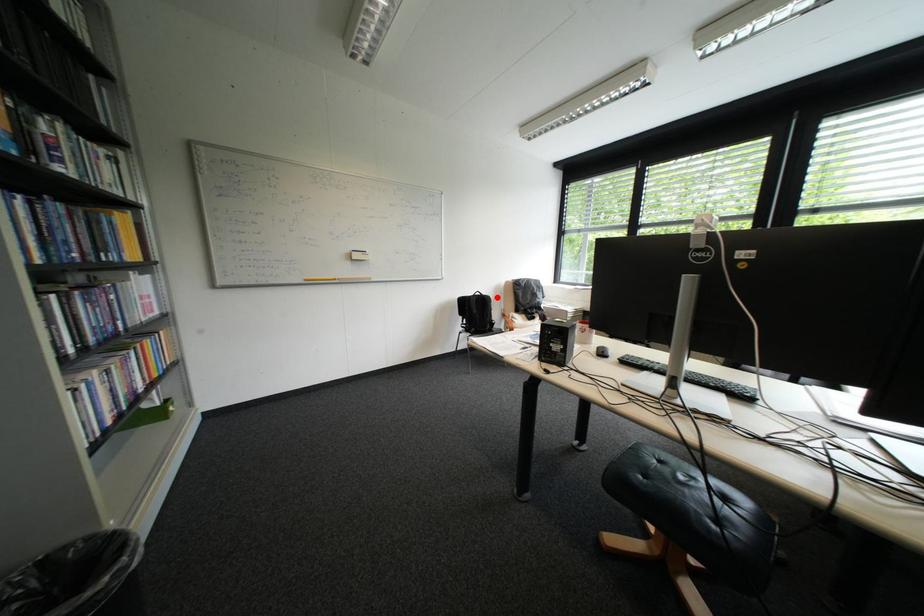
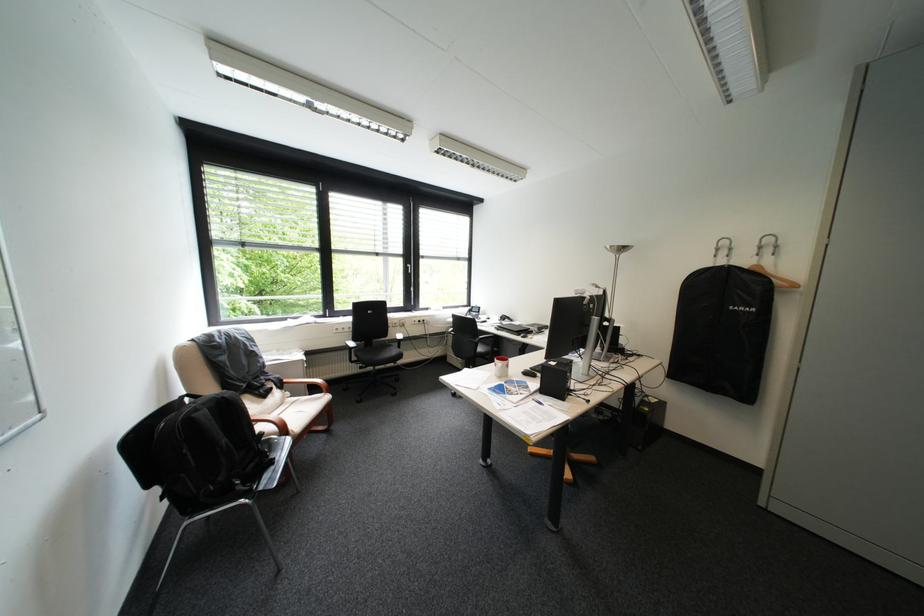
Question: I am providing you with two images of the same scene from different viewpoints. A red point is shown in image1. For the corresponding object point in image2, is it positioned nearer or farther from the camera?

Choices:
 (A) Nearer
 (B) Farther

Answer: (A)